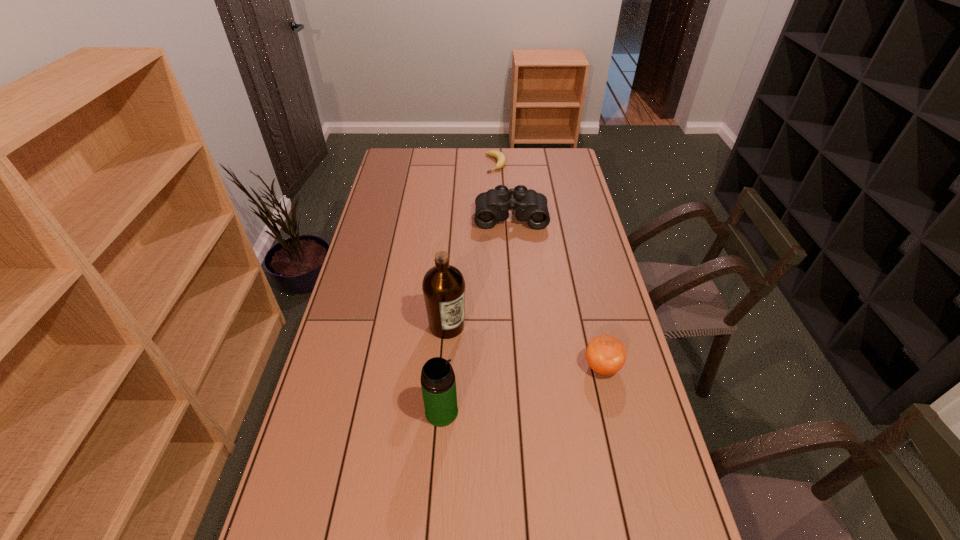
The image size is (960, 540). I want to click on free space on the desktop that is between the thermos bottle and the rightmost object and is positioned on the label of the olive oil, so click(501, 395).

The width and height of the screenshot is (960, 540). In order to click on vacant spot on the desktop that is between the fourth shortest object and the orange and is positioned at the stem of the banana in this screenshot , I will do `click(545, 383)`.

At what (x,y) coordinates should I click in order to perform the action: click on vacant space on the desktop that is between the nearest object and the rightmost object and is positioned at the eyepieces of the binoculars. Please return your answer as a coordinate pair (x, y). This screenshot has height=540, width=960. Looking at the image, I should click on (519, 390).